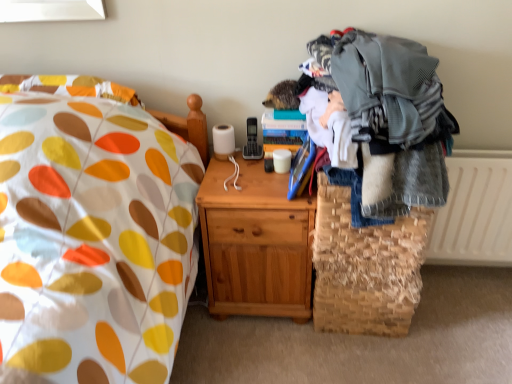
Where is `vacant area that is in front of woven straw basket at lower right`? The height and width of the screenshot is (384, 512). vacant area that is in front of woven straw basket at lower right is located at coordinates (372, 361).